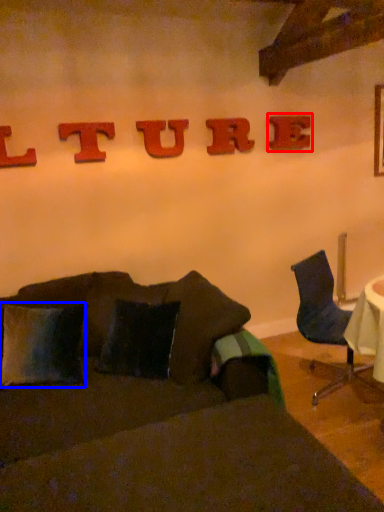
Question: Which point is further to the camera, alphabet (highlighted by a red box) or pillow (highlighted by a blue box)?

Choices:
 (A) alphabet
 (B) pillow

Answer: (A)